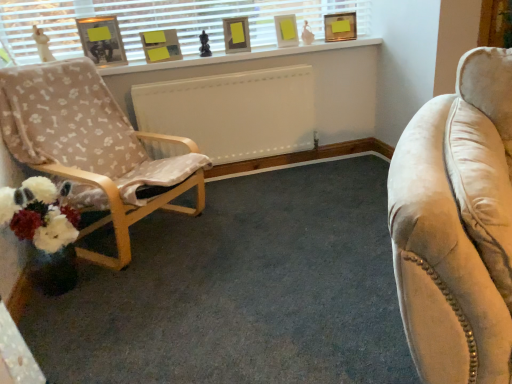
Question: From the image's perspective, is matte white picture frame at upper center, marked as the 4th picture frame in a left-to-right arrangement, beneath white painted wood at upper center?

Choices:
 (A) yes
 (B) no

Answer: (B)

Question: Can you confirm if matte white picture frame at upper center, arranged as the second picture frame when viewed from the right, is bigger than white painted wood at upper center?

Choices:
 (A) yes
 (B) no

Answer: (B)

Question: Would you say matte white picture frame at upper center, marked as the 4th picture frame in a left-to-right arrangement, contains white painted wood at upper center?

Choices:
 (A) yes
 (B) no

Answer: (B)

Question: Does matte white picture frame at upper center, arranged as the second picture frame when viewed from the right, appear on the right side of white painted wood at upper center?

Choices:
 (A) yes
 (B) no

Answer: (A)

Question: From a real-world perspective, is matte white picture frame at upper center, arranged as the second picture frame when viewed from the right, beneath white painted wood at upper center?

Choices:
 (A) yes
 (B) no

Answer: (B)

Question: From a real-world perspective, is matte white picture frame at upper center, arranged as the second picture frame when viewed from the right, positioned over white painted wood at upper center based on gravity?

Choices:
 (A) no
 (B) yes

Answer: (B)

Question: From a real-world perspective, is matte gold picture frame at upper center, acting as the 5th picture frame starting from the left, on matte black picture frame at upper left, the first picture frame in the left-to-right sequence?

Choices:
 (A) no
 (B) yes

Answer: (A)

Question: Considering the relative positions of matte gold picture frame at upper center, acting as the 5th picture frame starting from the left, and matte black picture frame at upper left, the first picture frame in the left-to-right sequence, in the image provided, is matte gold picture frame at upper center, acting as the 5th picture frame starting from the left, to the left of matte black picture frame at upper left, the first picture frame in the left-to-right sequence, from the viewer's perspective?

Choices:
 (A) no
 (B) yes

Answer: (A)

Question: Does matte gold picture frame at upper center, acting as the 5th picture frame starting from the left, lie behind matte black picture frame at upper left, the first picture frame in the left-to-right sequence?

Choices:
 (A) yes
 (B) no

Answer: (A)

Question: Does matte gold picture frame at upper center, acting as the 5th picture frame starting from the left, appear on the right side of matte black picture frame at upper left, the fifth picture frame in the right-to-left sequence?

Choices:
 (A) yes
 (B) no

Answer: (A)

Question: Can you confirm if matte gold picture frame at upper center, positioned as the first picture frame in right-to-left order, is wider than matte black picture frame at upper left, the fifth picture frame in the right-to-left sequence?

Choices:
 (A) yes
 (B) no

Answer: (B)

Question: Is the position of matte gold picture frame at upper center, positioned as the first picture frame in right-to-left order, less distant than that of matte black picture frame at upper left, the fifth picture frame in the right-to-left sequence?

Choices:
 (A) no
 (B) yes

Answer: (A)

Question: Is matte white picture frame at upper center, arranged as the second picture frame when viewed from the right, thinner than matte black picture frame at upper left, the fifth picture frame in the right-to-left sequence?

Choices:
 (A) no
 (B) yes

Answer: (B)